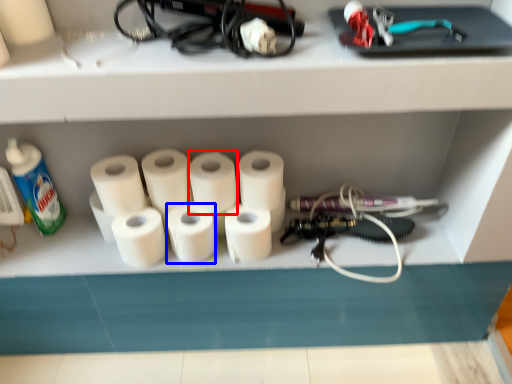
Question: Which of the following is the closest to the observer, toilet paper (highlighted by a red box) or paper towel (highlighted by a blue box)?

Choices:
 (A) toilet paper
 (B) paper towel

Answer: (A)